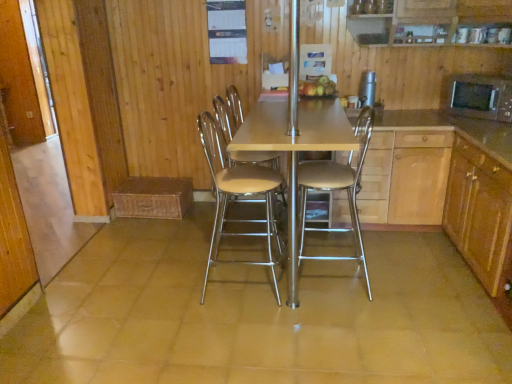
Locate an element on the screen. The image size is (512, 384). free point behind metallic beige stool at center, the 1th chair in the right-to-left sequence is located at coordinates (330, 249).